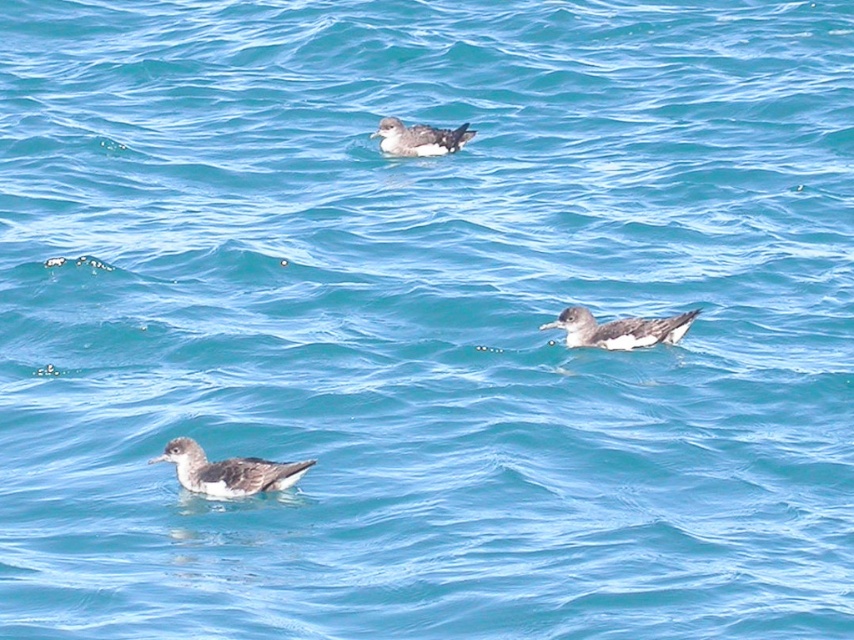
Does dark gray speckled bird at center appear over dark gray feathers at upper center?

Incorrect, dark gray speckled bird at center is not positioned above dark gray feathers at upper center.

Can you confirm if dark gray speckled bird at center is positioned to the left of dark gray feathers at upper center?

In fact, dark gray speckled bird at center is to the right of dark gray feathers at upper center.

Between point (623, 320) and point (384, 138), which one is positioned in front?

Point (623, 320)

At what (x,y) coordinates should I click in order to perform the action: click on dark gray speckled bird at center. Please return your answer as a coordinate pair (x, y). Looking at the image, I should click on (619, 330).

Between speckled gray bird at center and dark gray feathers at upper center, which one is positioned lower?

Positioned lower is speckled gray bird at center.

Which is behind, point (279, 490) or point (431, 141)?

The point (431, 141) is behind.

Does point (237, 476) lie in front of point (447, 132)?

Yes, point (237, 476) is closer to viewer.

Image resolution: width=854 pixels, height=640 pixels. Identify the location of speckled gray bird at center. (227, 472).

This screenshot has width=854, height=640. Describe the element at coordinates (227, 472) in the screenshot. I see `speckled gray bird at center` at that location.

Is speckled gray bird at center to the left of dark gray speckled bird at center from the viewer's perspective?

Yes, speckled gray bird at center is to the left of dark gray speckled bird at center.

Identify the location of speckled gray bird at center. The height and width of the screenshot is (640, 854). (227, 472).

Locate an element on the screen. speckled gray bird at center is located at coordinates (227, 472).